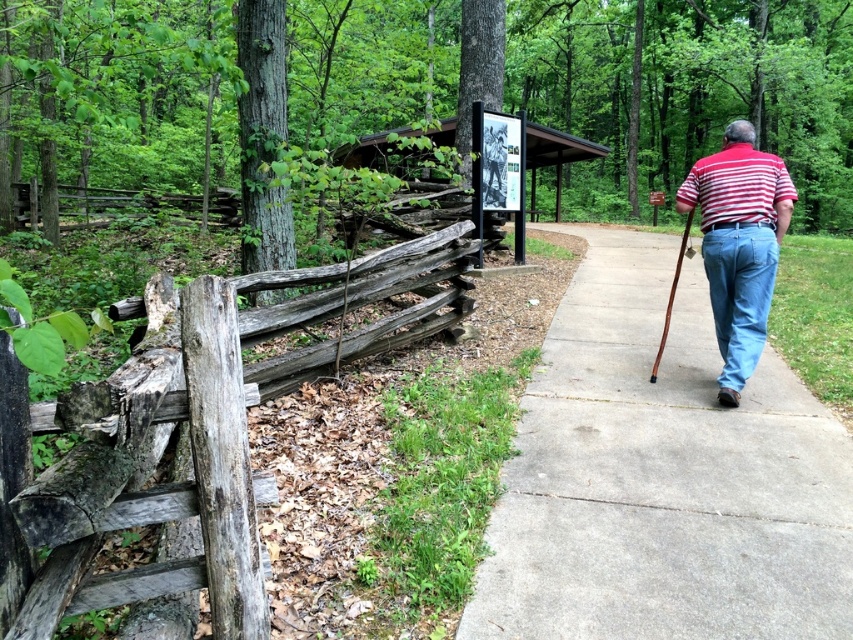
Question: Is concrete sidewalk at center positioned in front of striped cotton shirt at right?

Choices:
 (A) no
 (B) yes

Answer: (B)

Question: Can you confirm if concrete sidewalk at center is thinner than striped cotton shirt at right?

Choices:
 (A) yes
 (B) no

Answer: (B)

Question: Does concrete sidewalk at center appear on the right side of weathered wood fence at left?

Choices:
 (A) yes
 (B) no

Answer: (A)

Question: Which point appears farthest from the camera in this image?

Choices:
 (A) (711, 392)
 (B) (723, 259)
 (C) (755, 246)

Answer: (A)

Question: Which of the following is the closest to the observer?

Choices:
 (A) (581, 330)
 (B) (373, 285)
 (C) (726, 266)
 (D) (763, 330)

Answer: (B)

Question: Which is nearer to the concrete sidewalk at center?

Choices:
 (A) light blue denim jeans at right
 (B) weathered wood fence at left

Answer: (A)